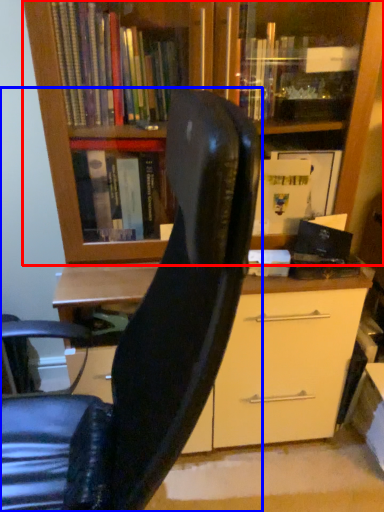
Question: Which object is closer to the camera taking this photo, bookcase (highlighted by a red box) or chair (highlighted by a blue box)?

Choices:
 (A) bookcase
 (B) chair

Answer: (B)